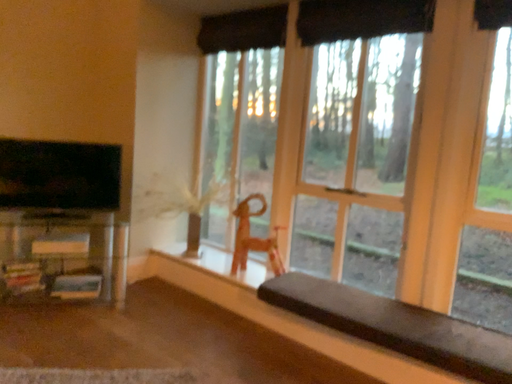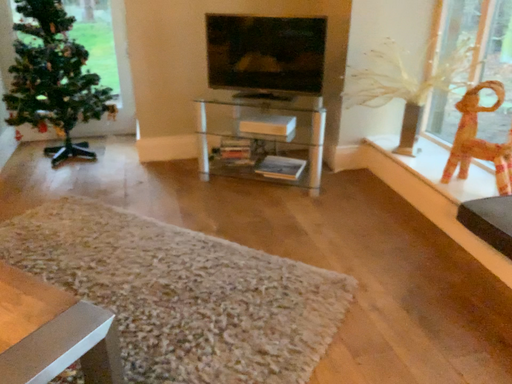
Question: Which way did the camera rotate in the video?

Choices:
 (A) rotated right
 (B) rotated left

Answer: (B)